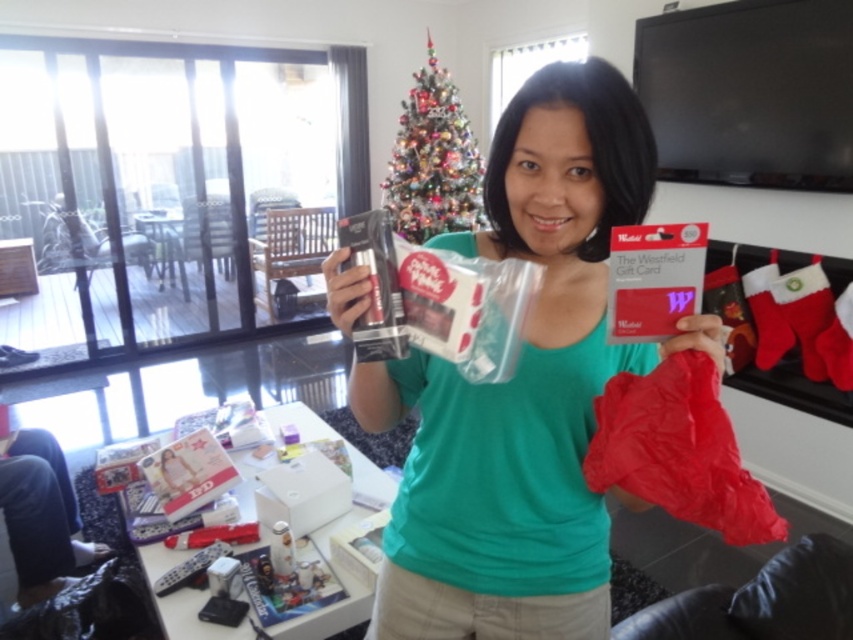
You are a delivery person who needs to place a package between the green matte shirt at center and the shiny silver christmas tree at upper center. The package requires 3 meters of space. Is there enough space?

The green matte shirt at center and the shiny silver christmas tree at upper center are 3.22 meters apart, so yes, there is enough space to place the package between them since 3.22 meters is greater than the required 3 meters.

In the scene shown: You are standing in the living room and want to find the green matte shirt at center. According to the scene description, where should you look to locate it?

The green matte shirt at center is located at point (523, 387), so you should look there to find it.